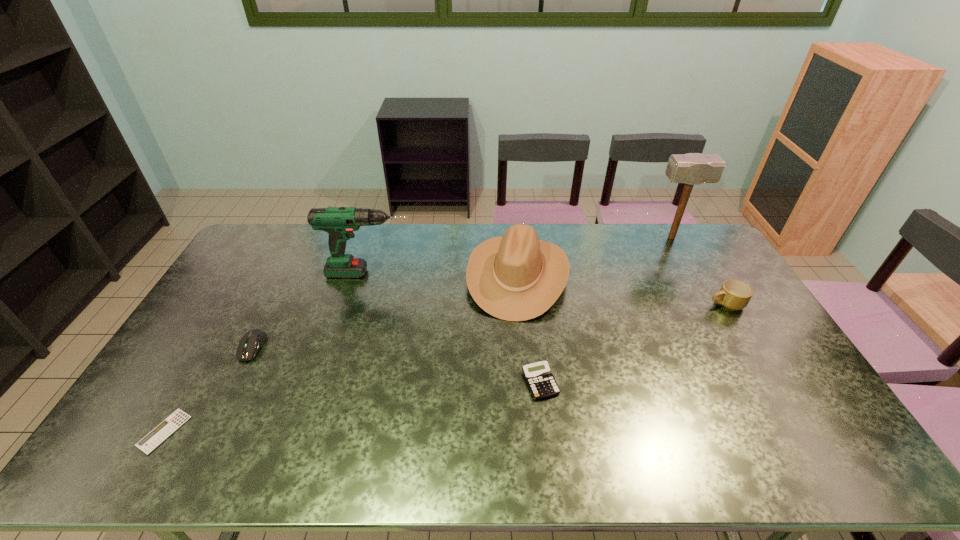
The width and height of the screenshot is (960, 540). I want to click on the tallest object, so click(x=692, y=169).

Find the location of a particular element. Image resolution: width=960 pixels, height=540 pixels. drill is located at coordinates (340, 222).

You are a GUI agent. You are given a task and a screenshot of the screen. Output one action in this format:
    pyautogui.click(x=<x>, y=<y>)
    Task: Click on the second tallest object
    This screenshot has width=960, height=540.
    Given the screenshot: What is the action you would take?
    pyautogui.click(x=340, y=222)

Where is `the fifth shortest object`? the fifth shortest object is located at coordinates (517, 277).

I want to click on the fourth shortest object, so click(x=734, y=294).

Where is `the second object from left to right`? The image size is (960, 540). the second object from left to right is located at coordinates (249, 345).

The height and width of the screenshot is (540, 960). Find the location of `the third shortest object`. the third shortest object is located at coordinates (249, 345).

Where is `the taller calculator`? The image size is (960, 540). the taller calculator is located at coordinates (542, 384).

Where is `the farther calculator`? This screenshot has width=960, height=540. the farther calculator is located at coordinates click(542, 384).

This screenshot has height=540, width=960. I want to click on the nearest object, so click(167, 427).